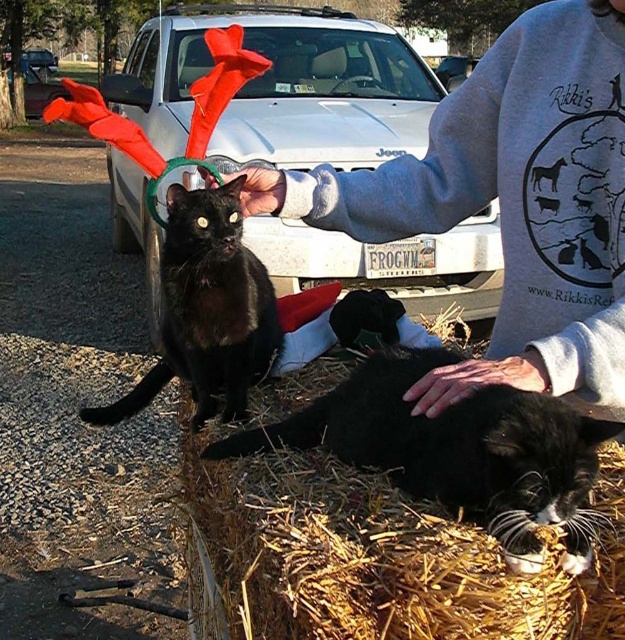
You are a photographer trying to capture both the black fur at lower right and the black matte fur cat at left in the same frame. Based on their positions, which one should you focus on first to ensure both are in focus?

The black fur at lower right is located below the black matte fur cat at left, so you should focus on the black matte fur cat at left first since it is closer to the camera, ensuring both will be in focus when using depth of field.

You are trying to find the black fur at lower right and the black matte fur cat at left in the image. Which one is located to the right of the other?

The black fur at lower right is positioned on the right side of black matte fur cat at left.

You are taking a photo of two black cats on a gravel driveway. You notice two specific points in the image labeled as point (445, 157) and point (228, 378). Which point is closer to your camera?

Point (445, 157) is further to the camera than point (228, 378), so point (228, 378) is closer to the camera.